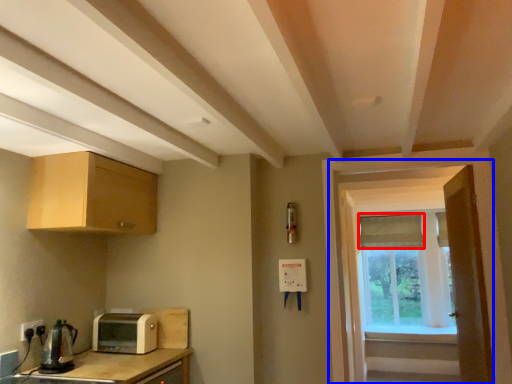
Question: Which object is closer to the camera taking this photo, curtain (highlighted by a red box) or screen door (highlighted by a blue box)?

Choices:
 (A) curtain
 (B) screen door

Answer: (B)